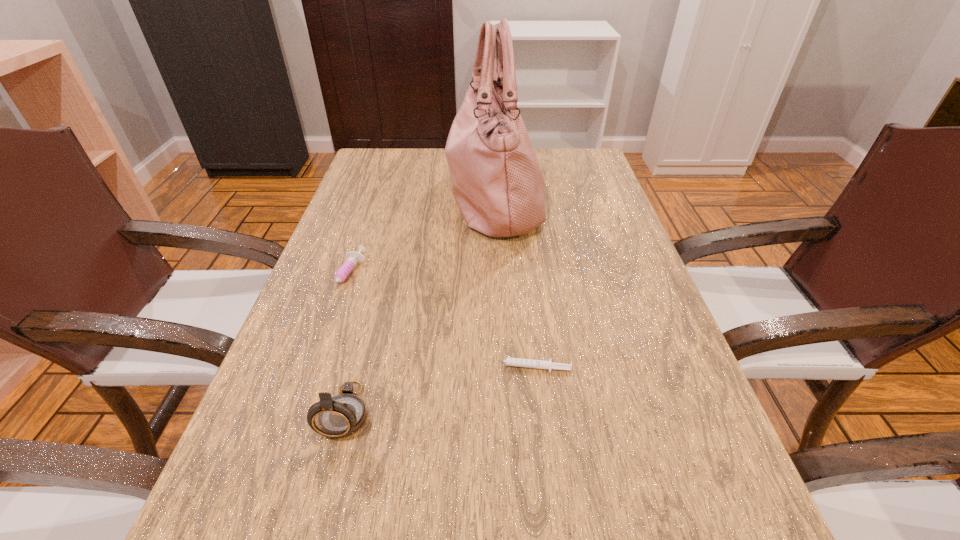
Where is `vacant space that satisfies the following two spatial constraints: 1. at the front of the farthest object with handles; 2. on the left side of the shorter syringe`? The height and width of the screenshot is (540, 960). vacant space that satisfies the following two spatial constraints: 1. at the front of the farthest object with handles; 2. on the left side of the shorter syringe is located at coordinates (502, 368).